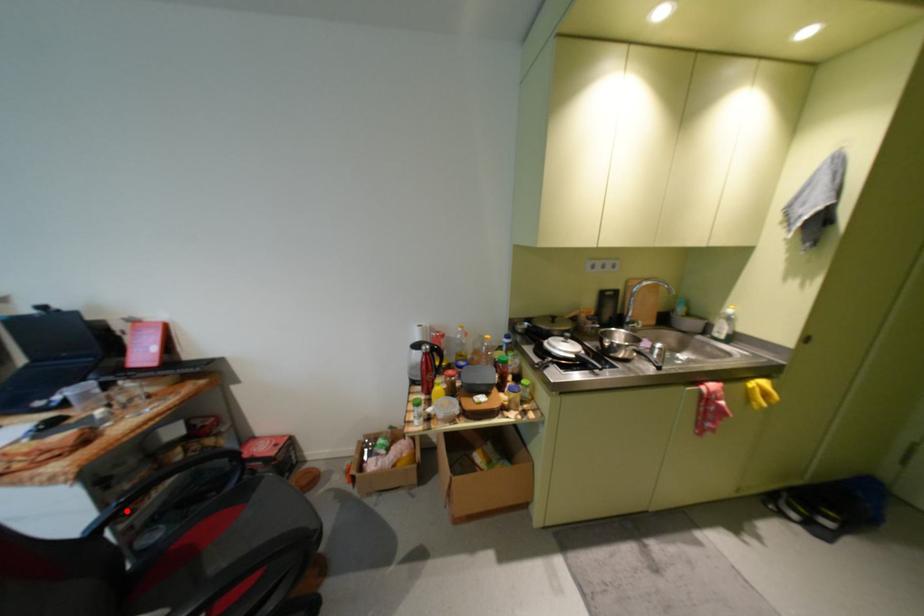
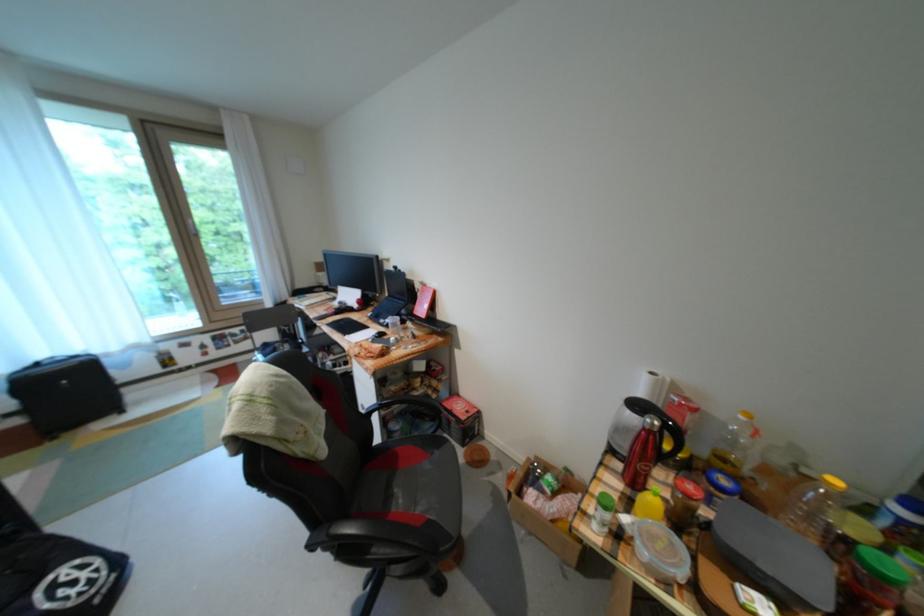
Question: I am providing you with two images of the same scene from different viewpoints. Image1 has a red point marked. In image2, the corresponding 3D location appears at what relative position? Reply with the corresponding letter.

Choices:
 (A) Closer
 (B) Farther

Answer: (A)